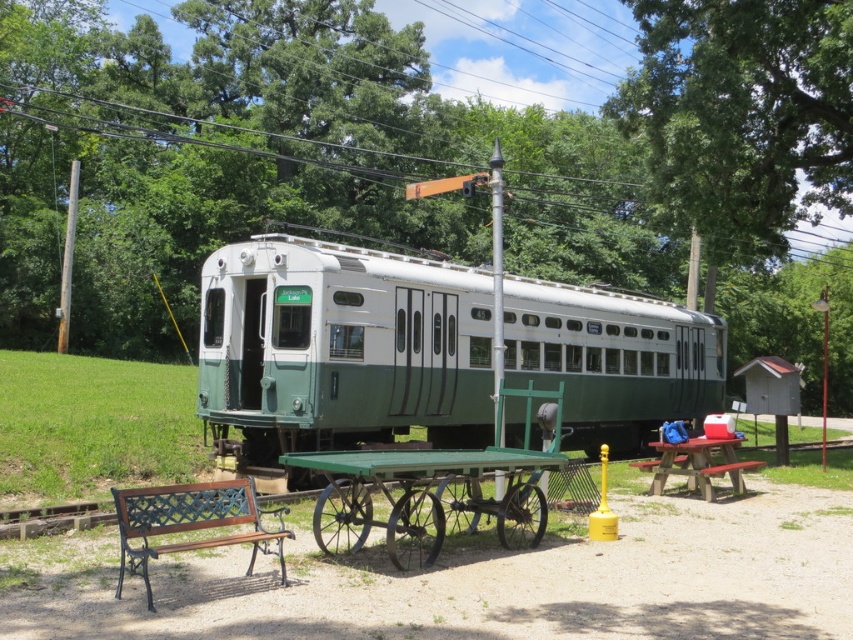
Who is taller, white plastic power line at upper center or red wood picnic table at center right?

Standing taller between the two is white plastic power line at upper center.

Is white plastic power line at upper center taller than red wood picnic table at center right?

Correct, white plastic power line at upper center is much taller as red wood picnic table at center right.

Is point (602, 180) behind point (677, 465)?

That is True.

At what (x,y) coordinates should I click in order to perform the action: click on white plastic power line at upper center. Please return your answer as a coordinate pair (x, y). Looking at the image, I should click on [819, 234].

Is point (120, 504) farther from camera compared to point (728, 461)?

No, (120, 504) is in front of (728, 461).

Between brown wood bench at lower left and red wood picnic table at center right, which one appears on the left side from the viewer's perspective?

brown wood bench at lower left

Where is `brown wood bench at lower left`? Image resolution: width=853 pixels, height=640 pixels. brown wood bench at lower left is located at coordinates (190, 522).

Does green metal cart at center appear on the left side of red wood picnic table at center right?

Indeed, green metal cart at center is positioned on the left side of red wood picnic table at center right.

Does green metal cart at center have a lesser height compared to red wood picnic table at center right?

Yes.

Between point (347, 454) and point (653, 484), which one is positioned in front?

Positioned in front is point (347, 454).

I want to click on green metal cart at center, so click(x=431, y=490).